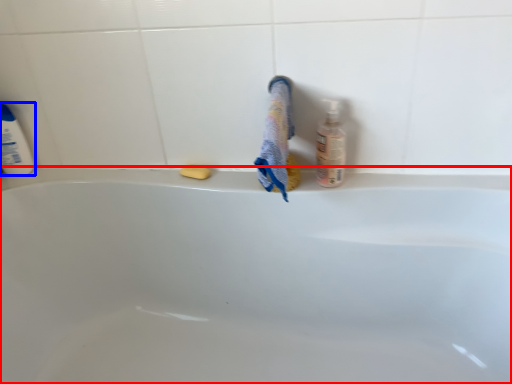
Question: Which object appears closest to the camera in this image, bathtub (highlighted by a red box) or cleaning product (highlighted by a blue box)?

Choices:
 (A) bathtub
 (B) cleaning product

Answer: (A)